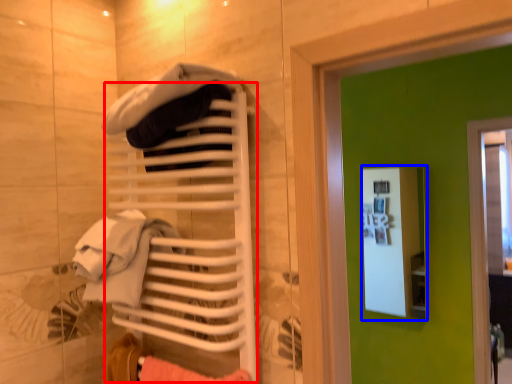
Question: Among these objects, which one is farthest to the camera, closet (highlighted by a red box) or medicine cabinet (highlighted by a blue box)?

Choices:
 (A) closet
 (B) medicine cabinet

Answer: (B)